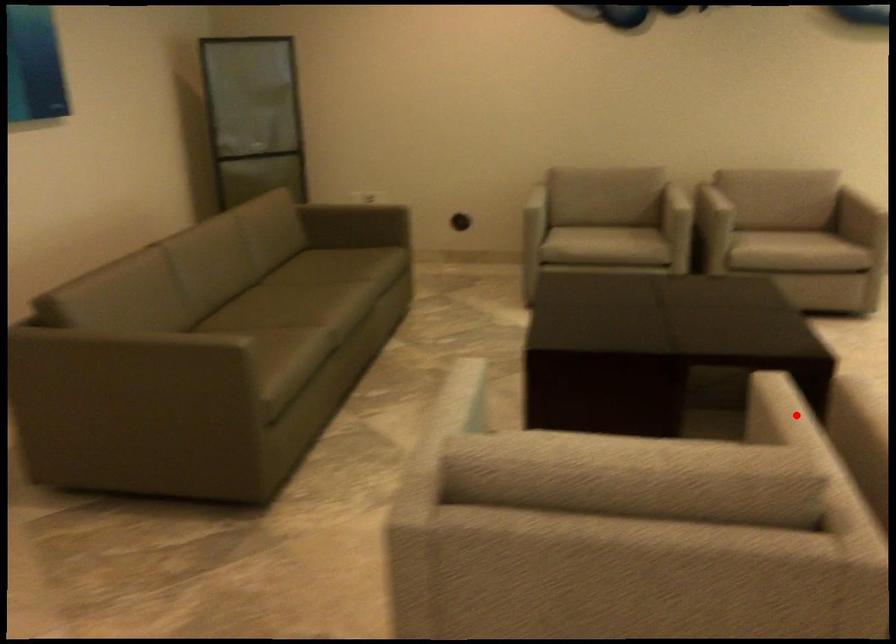
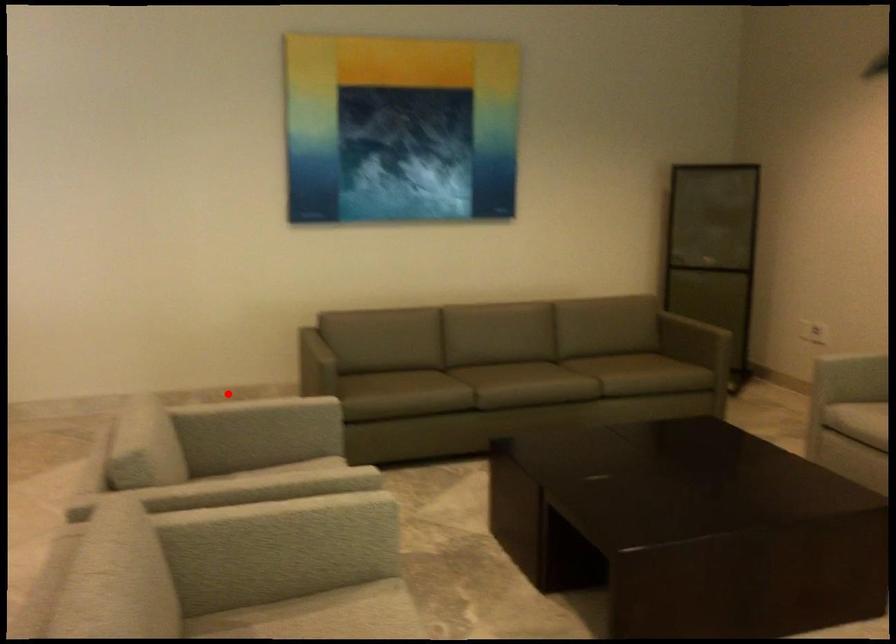
I am providing you with two images of the same scene from different viewpoints. A red point is marked on the first image and another point is marked on the second image. Are the points marked in image1 and image2 representing the same 3D position?

No